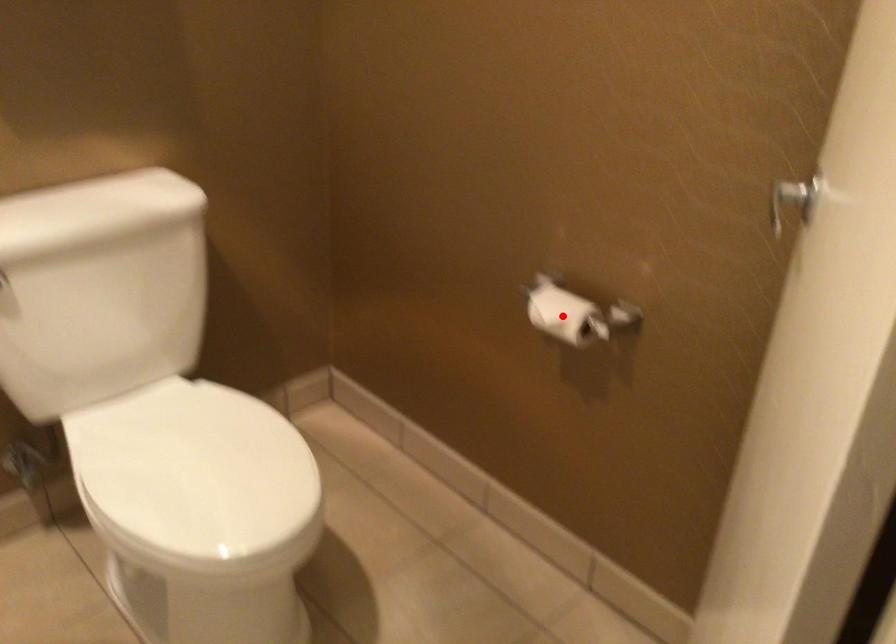
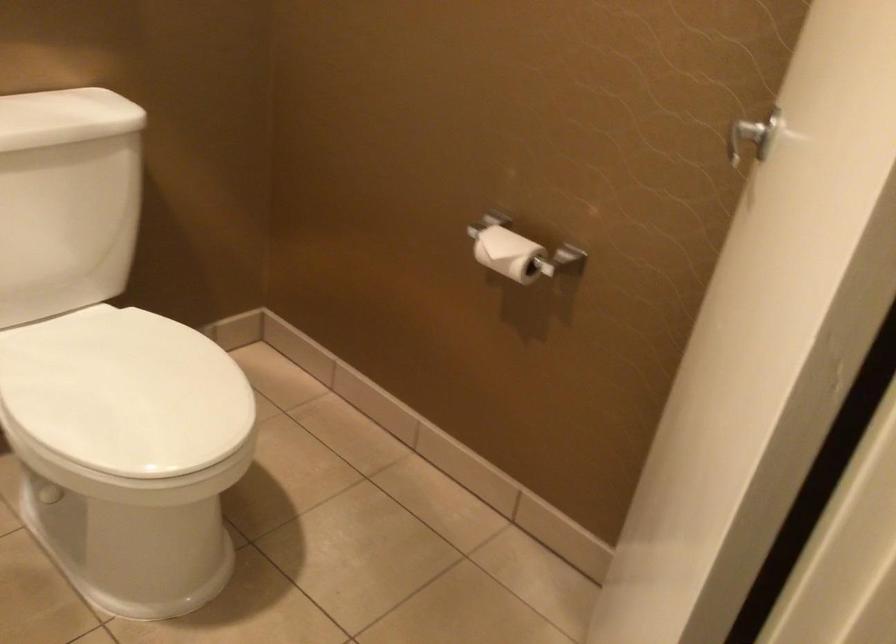
Find the pixel in the second image that matches the highlighted location in the first image.

(507, 252)